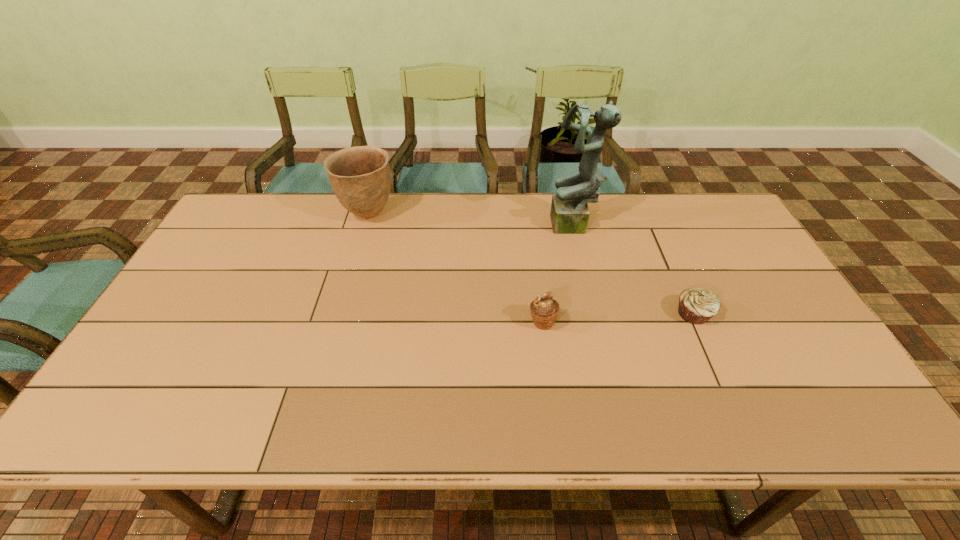
The height and width of the screenshot is (540, 960). In order to click on vacant space at the far left corner of the desktop in this screenshot , I will do `click(256, 197)`.

Where is `free spot between the leftmost object and the left muffin`? The width and height of the screenshot is (960, 540). free spot between the leftmost object and the left muffin is located at coordinates (455, 268).

I want to click on free spot between the shortest object and the tallest object, so [x=634, y=270].

The image size is (960, 540). I want to click on vacant area that lies between the shortest object and the pottery, so click(531, 264).

You are a GUI agent. You are given a task and a screenshot of the screen. Output one action in this format:
    pyautogui.click(x=<x>, y=<y>)
    Task: Click on the free space between the third object from left to right and the shorter muffin
    The height and width of the screenshot is (540, 960).
    Given the screenshot: What is the action you would take?
    pyautogui.click(x=634, y=270)

This screenshot has width=960, height=540. What are the coordinates of `free spot between the sculpture and the leftmost object` in the screenshot? It's located at (470, 221).

Identify the location of vacant area between the tallest object and the rightmost object. This screenshot has height=540, width=960. point(634,270).

You are a GUI agent. You are given a task and a screenshot of the screen. Output one action in this format:
    pyautogui.click(x=<x>, y=<y>)
    Task: Click on the vacant area that lies between the tallest object and the third shortest object
    Image resolution: width=960 pixels, height=540 pixels.
    Given the screenshot: What is the action you would take?
    pyautogui.click(x=470, y=221)

You are a GUI agent. You are given a task and a screenshot of the screen. Output one action in this format:
    pyautogui.click(x=<x>, y=<y>)
    Task: Click on the free spot between the pottery and the third object from right to left
    
    Given the screenshot: What is the action you would take?
    pyautogui.click(x=455, y=268)

The width and height of the screenshot is (960, 540). In order to click on vacant space that is in between the shortest object and the taller muffin in this screenshot , I will do (618, 318).